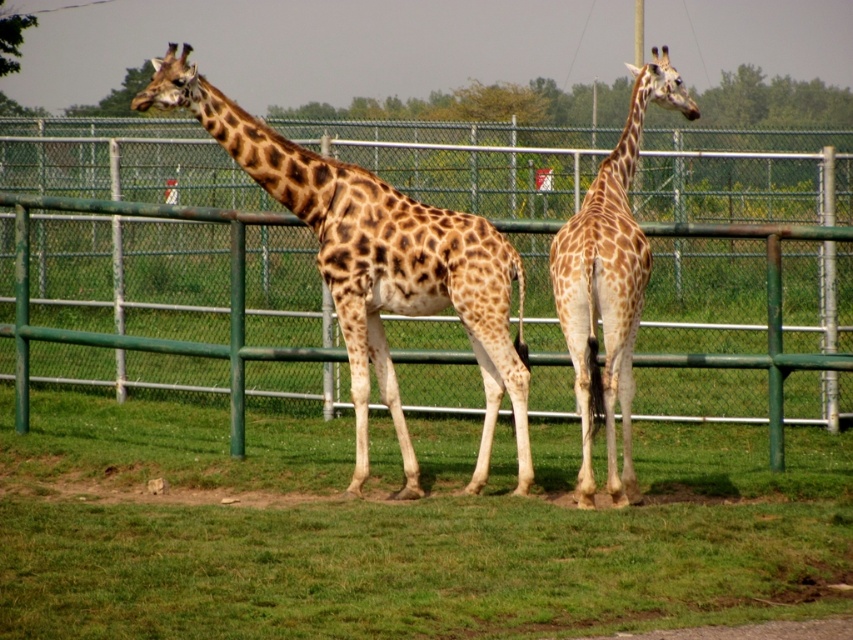
Question: Is green grass at lower center below green metal fence at center?

Choices:
 (A) no
 (B) yes

Answer: (B)

Question: Estimate the real-world distances between objects in this image. Which object is closer to the green grass at lower center?

Choices:
 (A) spotted fur giraffe at left
 (B) spotted fur giraffe at center

Answer: (A)

Question: Does spotted fur giraffe at left appear over spotted fur giraffe at center?

Choices:
 (A) no
 (B) yes

Answer: (B)

Question: Which point is farther from the camera taking this photo?

Choices:
 (A) (351, 182)
 (B) (254, 378)

Answer: (B)

Question: Among these objects, which one is farthest from the camera?

Choices:
 (A) green metal fence at center
 (B) spotted fur giraffe at center

Answer: (A)

Question: Is green metal fence at center wider than spotted fur giraffe at left?

Choices:
 (A) no
 (B) yes

Answer: (A)